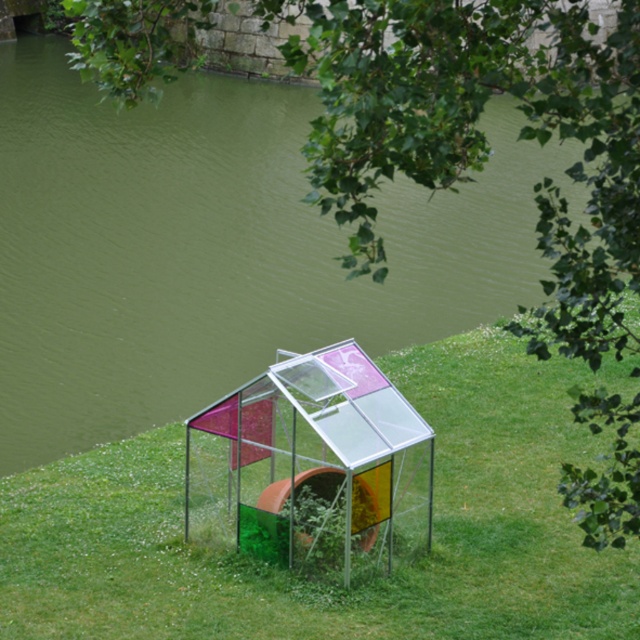
Question: Is green grass at center to the left of transparent plastic greenhouse at center from the viewer's perspective?

Choices:
 (A) yes
 (B) no

Answer: (B)

Question: Can you confirm if green grass at center is smaller than transparent plastic greenhouse at center?

Choices:
 (A) no
 (B) yes

Answer: (B)

Question: Does green grass at center have a greater width compared to transparent plastic greenhouse at center?

Choices:
 (A) yes
 (B) no

Answer: (B)

Question: Which point is closer to the camera?

Choices:
 (A) transparent plastic greenhouse at center
 (B) green grass at center

Answer: (A)